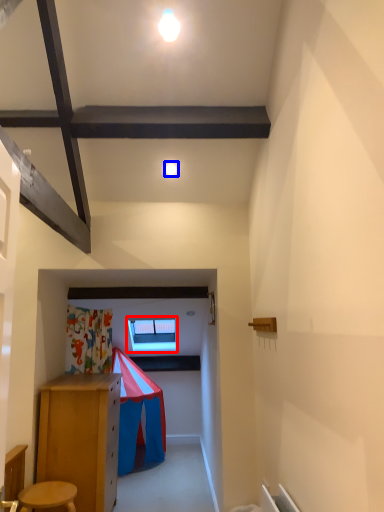
Question: Among these objects, which one is farthest to the camera, window (highlighted by a red box) or light (highlighted by a blue box)?

Choices:
 (A) window
 (B) light

Answer: (A)